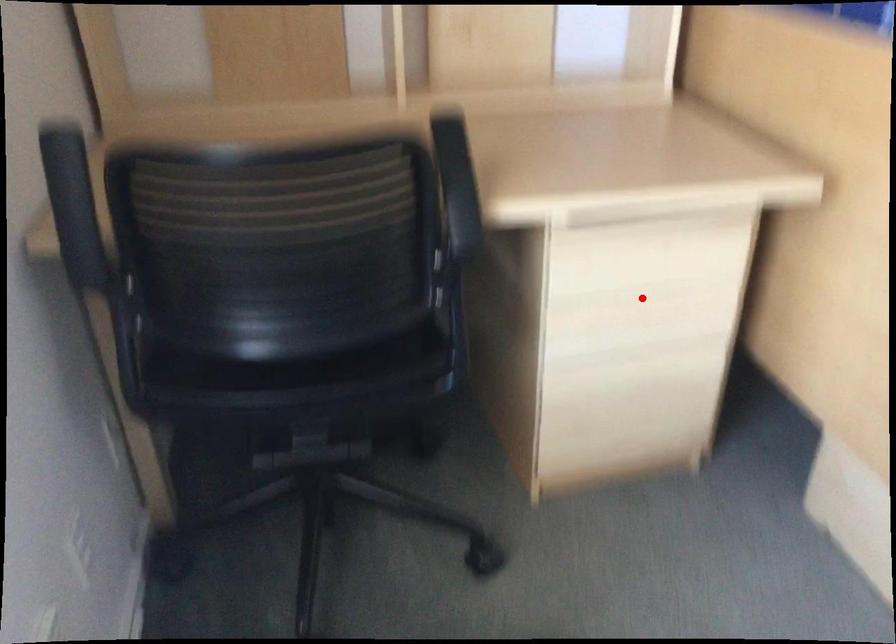
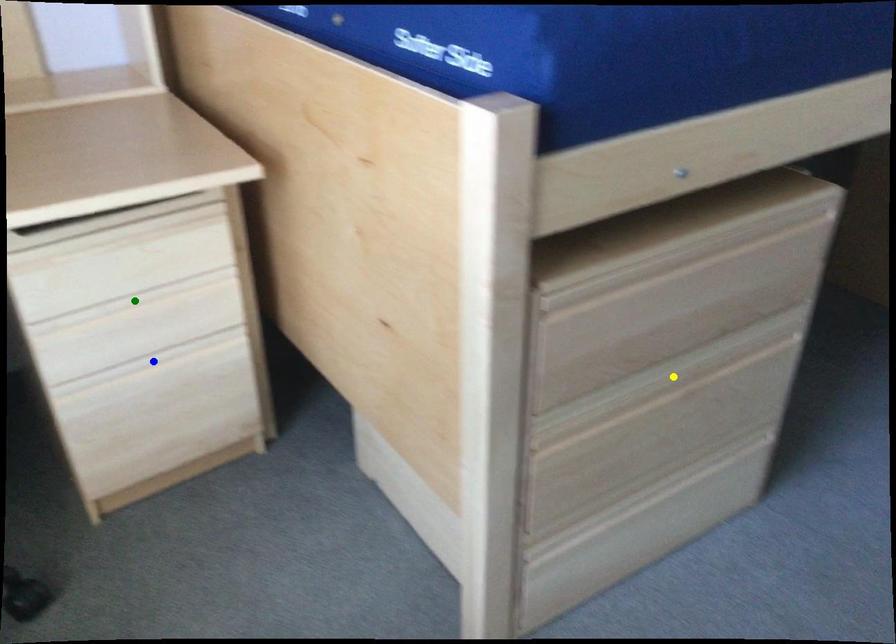
Question: I am providing you with two images of the same scene from different viewpoints. A red point is marked on the first image. You are given multiple points on the second image. Which point in image 2 is actually the same real-world point as the red point in image 1?

Choices:
 (A) yellow point
 (B) blue point
 (C) green point

Answer: (C)